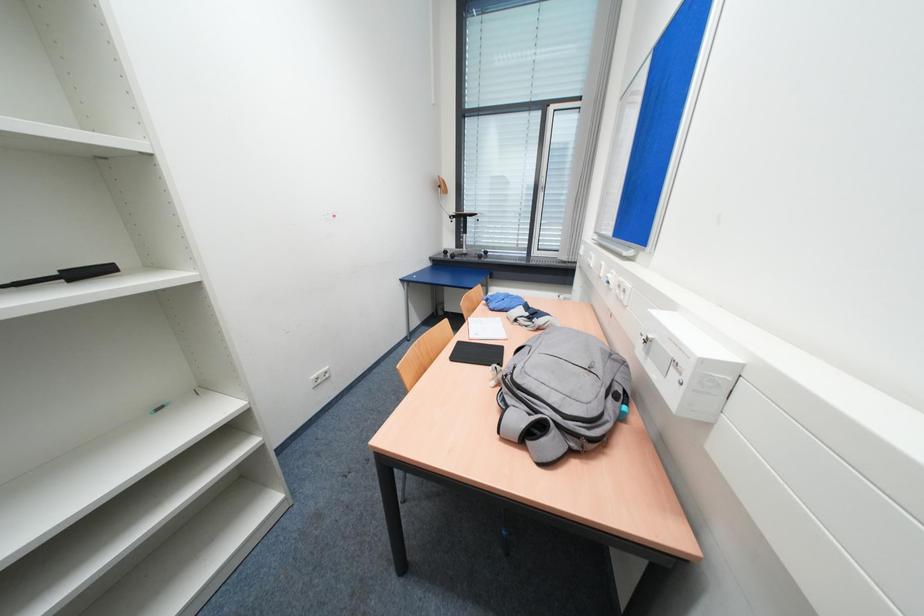
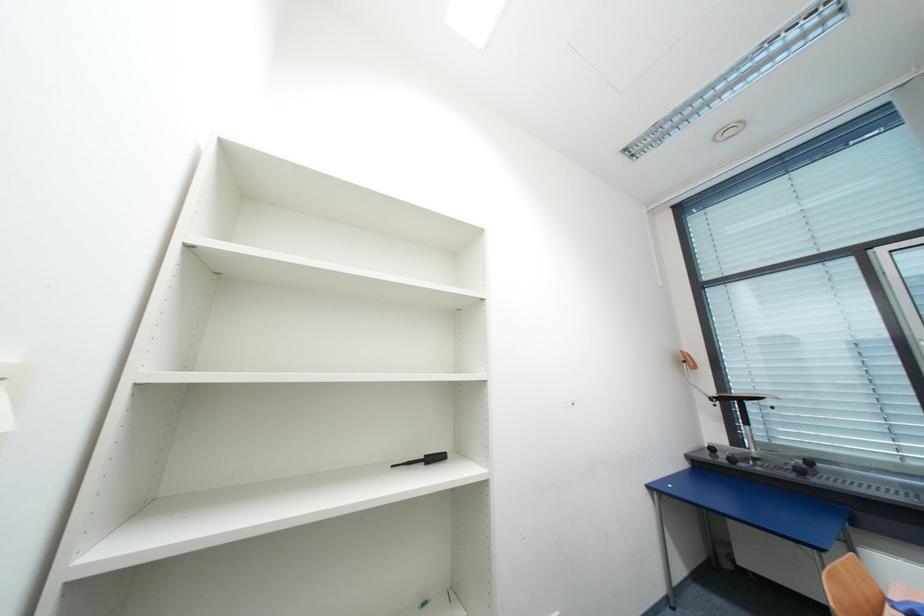
Consider the image. The first image is from the beginning of the video and the second image is from the end. How did the camera likely rotate when shooting the video?

The camera's rotation is toward left-up.